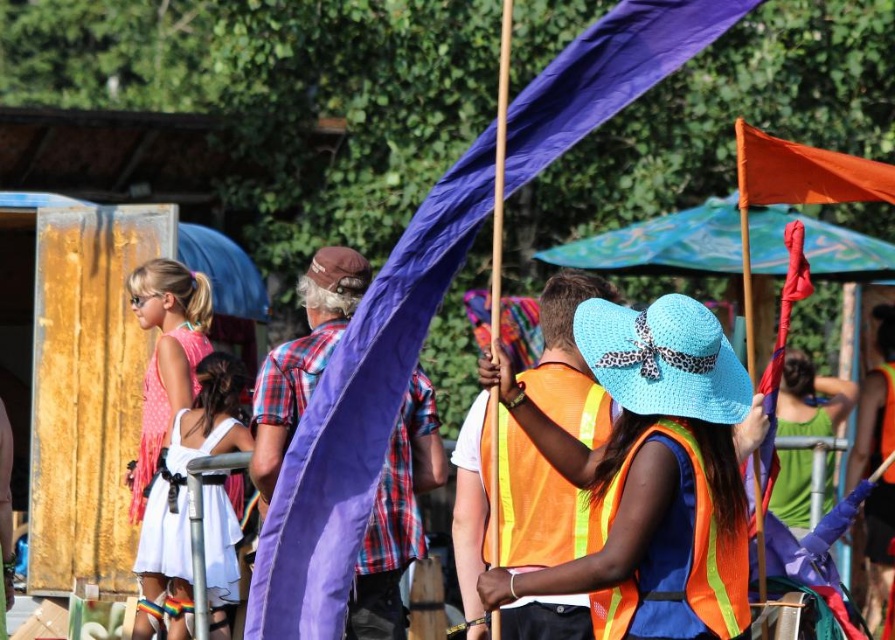
You are a photographer trying to capture both the blue woven hat at center and the white satin dress at lower left in a single shot. Which object should you focus on first to ensure both are in frame?

The blue woven hat at center is smaller than the white satin dress at lower left, so you should focus on the white satin dress at lower left first to ensure both are in frame.

You are a photographer trying to capture the neon orange safety vest at center and the orange fabric flag at right in the same frame. Based on their positions, which object is closer to the left side of your camera view?

The neon orange safety vest at center is to the left of the orange fabric flag at right, so the neon orange safety vest at center is closer to the left side of the camera view.